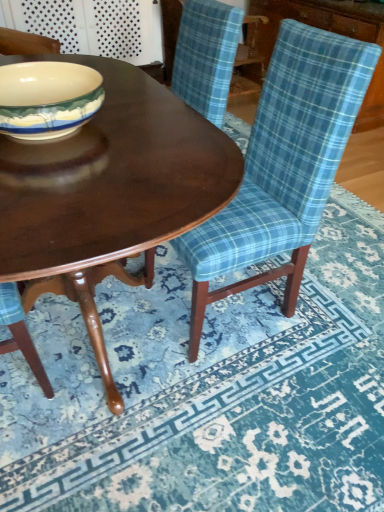
The image size is (384, 512). I want to click on vacant space in front of matte ceramic bowl at center-left, so click(x=65, y=178).